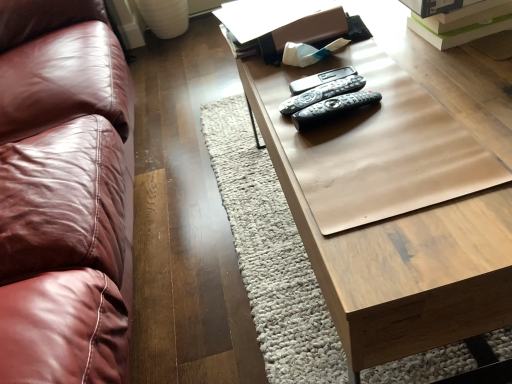
At what (x,y) coordinates should I click in order to perform the action: click on vacant space to the right of black plastic remotes at center, arranged as the 2th remote when viewed from the back. Please return your answer as a coordinate pair (x, y). The height and width of the screenshot is (384, 512). Looking at the image, I should click on (412, 86).